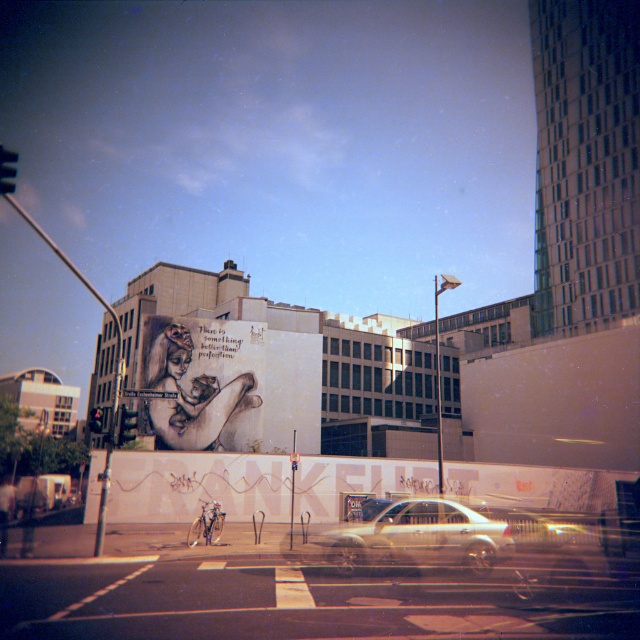
You are a delivery driver who needs to park your metallic silver sedan at center in a spot that is not blocked by the matte white mural at center. Is there enough space to park the car without the mural obstructing the entrance?

The matte white mural at center is above the metallic silver sedan at center, so it does not block the entrance. There is enough space to park the metallic silver sedan at center without obstruction from the mural.